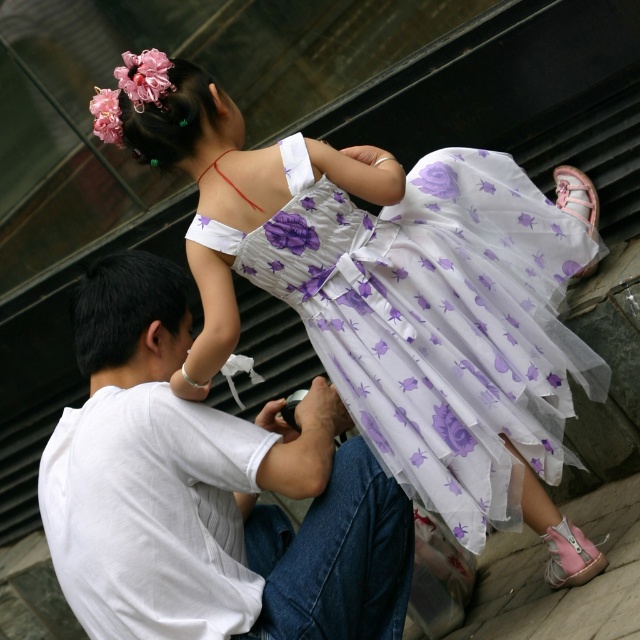
You are a photographer trying to capture a candid shot of the two subjects in the scene. The translucent floral dress at upper center and the white cotton shirt at center are both in your viewfinder. Given that your camera has a depth of field that can focus sharply on objects within 12 inches of each other, will both subjects be in focus?

The translucent floral dress at upper center is 13.59 inches from the white cotton shirt at center. Since the distance between them exceeds the camera lens depth of field limit of 12 inches, the two subjects will not be in focus simultaneously.

You are standing at the point labeled point (108, 337) and want to take a photo of the point labeled point (536, 493). Is there any obstruction between you and the subject?

Point (536, 493) is behind point (108, 337), so there is an obstruction between you and the subject.